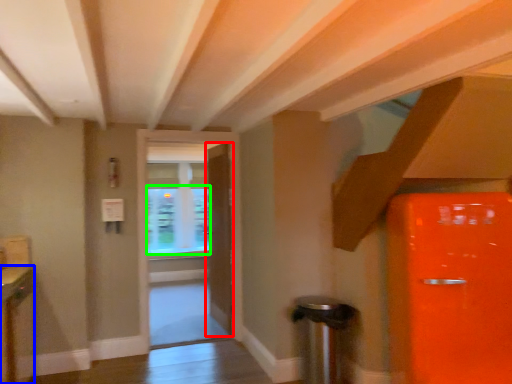
Question: Estimate the real-world distances between objects in this image. Which object is farther from door (highlighted by a red box), cabinetry (highlighted by a blue box) or window screen (highlighted by a green box)?

Choices:
 (A) cabinetry
 (B) window screen

Answer: (A)